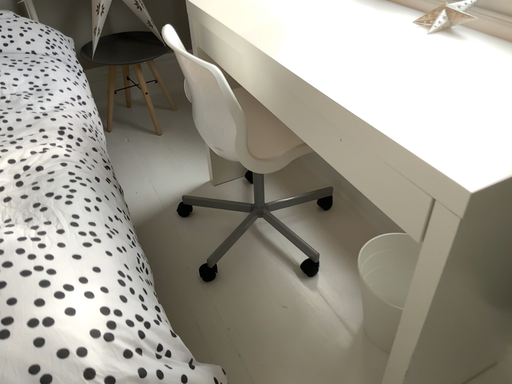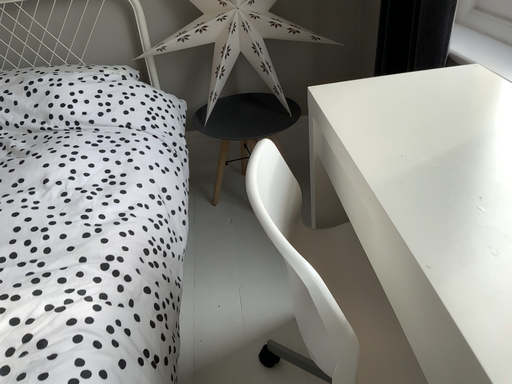
Question: How did the camera likely rotate when shooting the video?

Choices:
 (A) rotated right
 (B) rotated left

Answer: (B)